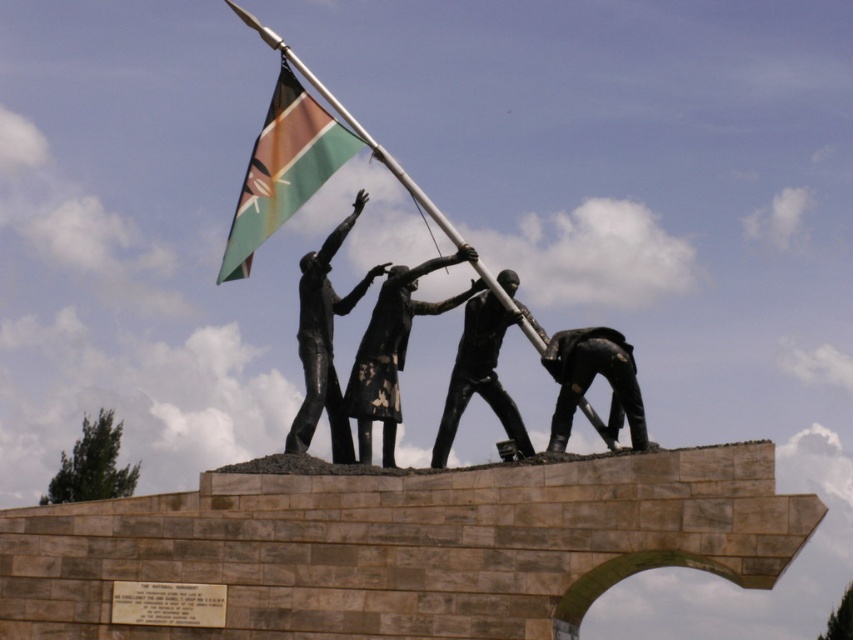
You are a tour guide explaining the monument to visitors. Pointing to the bronze statue at lower right and the black matte statue at center, you want to describe their positions relative to each other. How would you phrase this?

The bronze statue at lower right is positioned in front of the black matte statue at center, meaning it is closer to the viewers while the black matte statue at center is situated behind it.